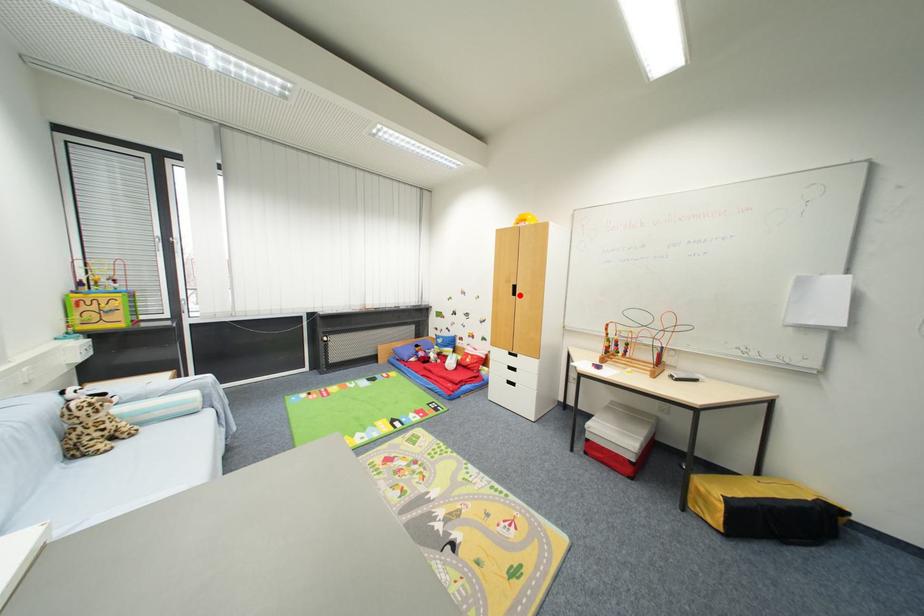
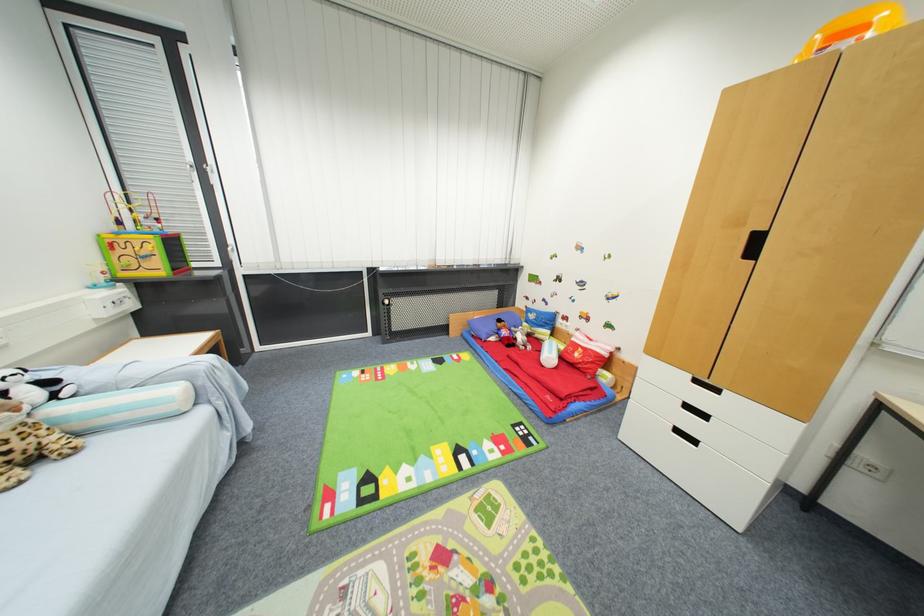
The point at the highlighted location is marked in the first image. Where is the corresponding point in the second image?

(757, 254)